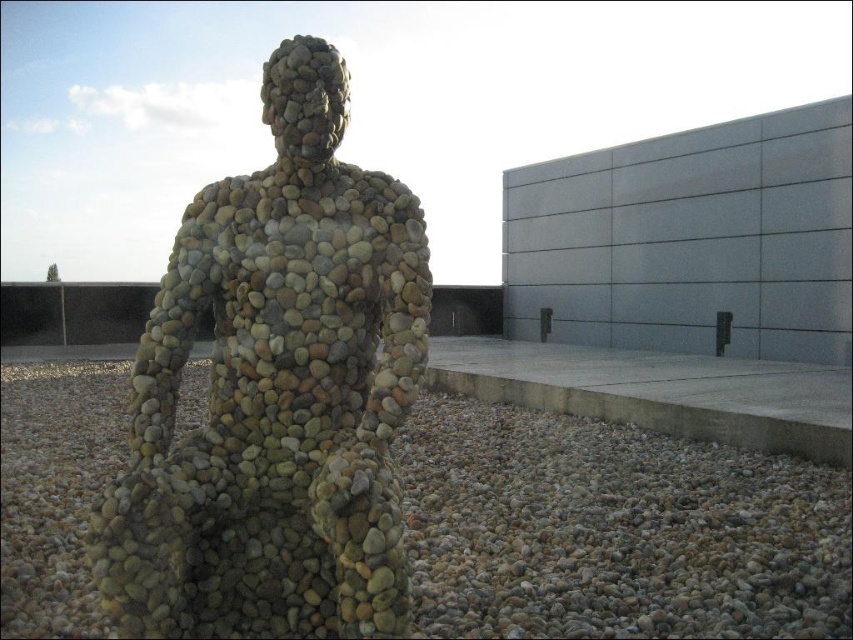
You are an artist trying to place a new sculpture in a gallery. You have a multicolored pebble sculpture at center and smooth pebbles at center. The gallery requires that the distance between any two sculptures must be at least 36 inches. Can you place them as shown in the image?

The multicolored pebble sculpture at center and smooth pebbles at center are 38.22 inches apart from each other, which exceeds the required 36 inches. Therefore, they can be placed as shown in the image.

You are an artist who wants to create a new sculpture using the materials in the scene. If you decide to place a new stone on top of the multicolored pebble sculpture at center, will it rest on the smooth pebbles at center?

The multicolored pebble sculpture at center is positioned over smooth pebbles at center, so placing a new stone on top of the multicolored pebble sculpture at center would mean it rests on the sculpture, not directly on the smooth pebbles at center.

You are standing in front of a modern building and see a point marked at coordinates [276,392]. Based on the scene description, what object is located at that point?

The point at coordinates [276,392] corresponds to the multicolored pebble sculpture at center.